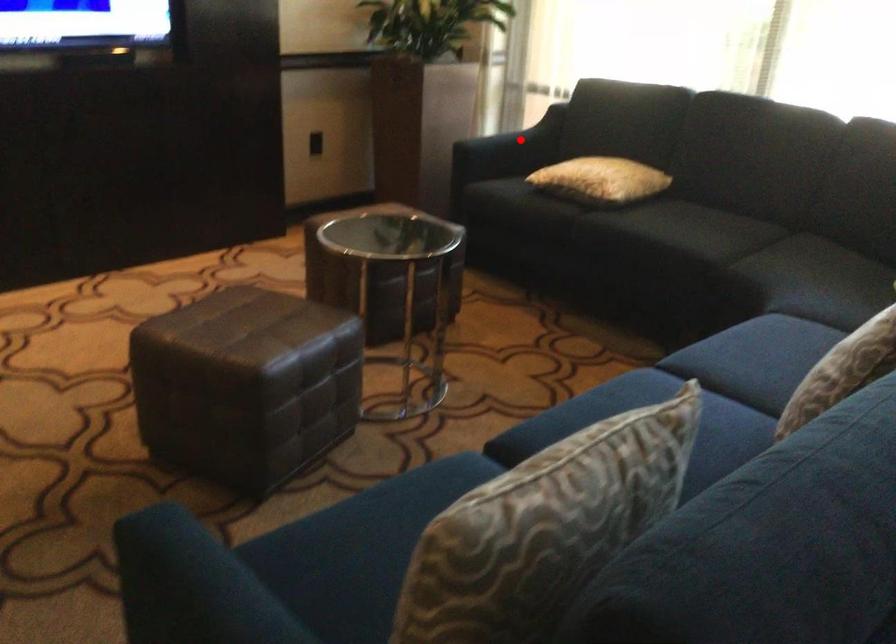
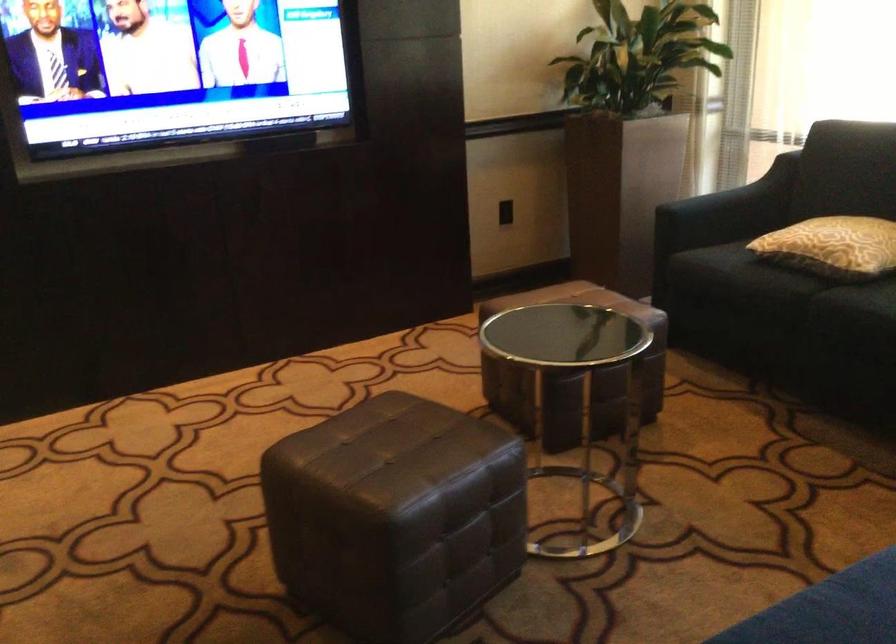
Question: I am providing you with two images of the same scene from different viewpoints. A red point is shown in image1. For the corresponding object point in image2, is it positioned nearer or farther from the camera?

Choices:
 (A) Nearer
 (B) Farther

Answer: (A)